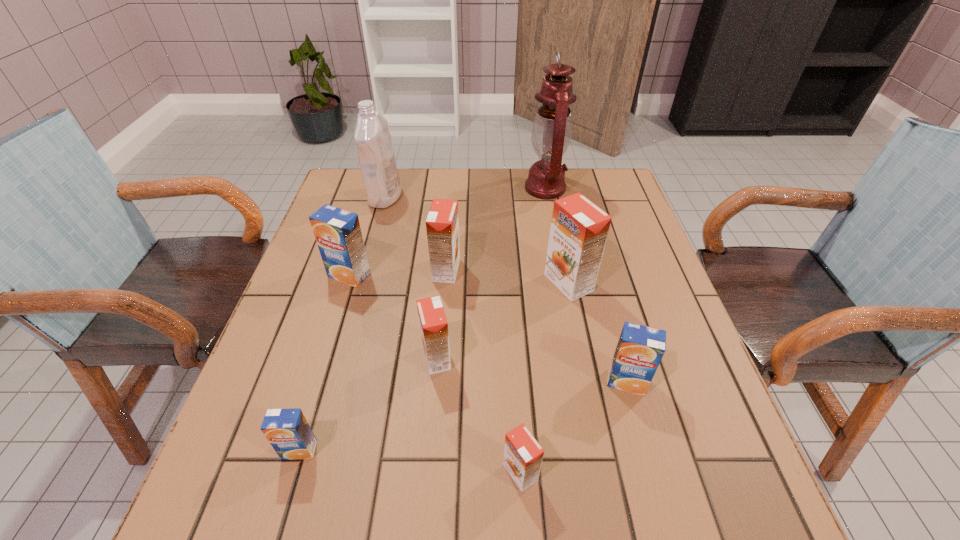
Locate an element on the screen. red oil lamp is located at coordinates (552, 128).

I want to click on oil lamp, so click(552, 128).

The width and height of the screenshot is (960, 540). What are the coordinates of `the second tallest object` in the screenshot? It's located at (375, 151).

The image size is (960, 540). I want to click on white detergent, so click(375, 151).

Where is `the biggest orange orange juice`? the biggest orange orange juice is located at coordinates pyautogui.click(x=579, y=229).

Identify the location of the rightmost orange orange juice. This screenshot has height=540, width=960. (579, 229).

What are the coordinates of `the biggest blue orange_juice` in the screenshot? It's located at (338, 234).

Where is `the third smallest orange orange juice`? the third smallest orange orange juice is located at coordinates (442, 225).

What are the coordinates of `the third biggest orange orange juice` in the screenshot? It's located at (433, 324).

Find the location of a particular element. The width and height of the screenshot is (960, 540). the second farthest blue orange_juice is located at coordinates (640, 348).